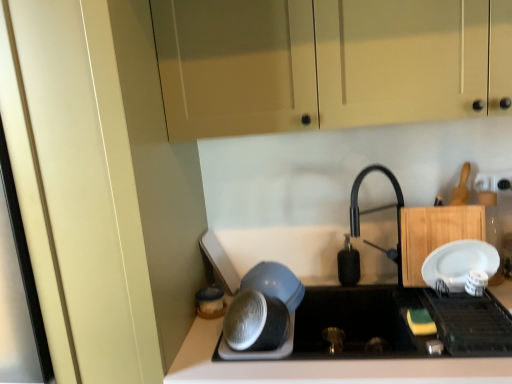
Question: Can we say matte cream cabinet at upper center, the 1th cabinetry when ordered from top to bottom, lies outside black matte soap dispenser at center, marked as the 1th appliance in a back-to-front arrangement?

Choices:
 (A) yes
 (B) no

Answer: (A)

Question: Can you confirm if matte cream cabinet at upper center, the second cabinetry ordered from the bottom, is thinner than black matte soap dispenser at center, placed as the 2th appliance when sorted from right to left?

Choices:
 (A) no
 (B) yes

Answer: (A)

Question: Is matte cream cabinet at upper center, the 1th cabinetry when ordered from top to bottom, shorter than black matte soap dispenser at center, placed as the 2th appliance when sorted from right to left?

Choices:
 (A) yes
 (B) no

Answer: (B)

Question: Can black matte soap dispenser at center, which is the 4th appliance from front to back, be found inside matte cream cabinet at upper center, the second cabinetry ordered from the bottom?

Choices:
 (A) no
 (B) yes

Answer: (A)

Question: Is matte cream cabinet at upper center, the 1th cabinetry when ordered from top to bottom, closer to camera compared to black matte soap dispenser at center, marked as the 1th appliance in a back-to-front arrangement?

Choices:
 (A) no
 (B) yes

Answer: (B)

Question: Can you confirm if matte cream cabinet at upper center, the second cabinetry ordered from the bottom, is positioned to the left of black matte soap dispenser at center, placed as the 2th appliance when sorted from right to left?

Choices:
 (A) no
 (B) yes

Answer: (B)

Question: Can you confirm if matte plastic container at lower center, which appears as the second appliance when viewed from the back, is smaller than black matte soap dispenser at center, marked as the 1th appliance in a back-to-front arrangement?

Choices:
 (A) no
 (B) yes

Answer: (B)

Question: Would you say matte plastic container at lower center, which appears as the second appliance when viewed from the back, is a long distance from black matte soap dispenser at center, marked as the 1th appliance in a back-to-front arrangement?

Choices:
 (A) yes
 (B) no

Answer: (B)

Question: Is matte plastic container at lower center, marked as the first appliance in a left-to-right arrangement, not inside black matte soap dispenser at center, marked as the 1th appliance in a back-to-front arrangement?

Choices:
 (A) no
 (B) yes

Answer: (B)

Question: Is black matte soap dispenser at center, which is the 4th appliance from front to back, inside matte plastic container at lower center, marked as the fourth appliance in a right-to-left arrangement?

Choices:
 (A) yes
 (B) no

Answer: (B)

Question: Is matte plastic container at lower center, which appears as the second appliance when viewed from the back, oriented away from black matte soap dispenser at center, marked as the third appliance in a left-to-right arrangement?

Choices:
 (A) no
 (B) yes

Answer: (A)

Question: Does matte plastic container at lower center, marked as the first appliance in a left-to-right arrangement, have a lesser width compared to black matte soap dispenser at center, which is the 4th appliance from front to back?

Choices:
 (A) yes
 (B) no

Answer: (B)

Question: Can you confirm if black matte soap dispenser at center, marked as the 1th appliance in a back-to-front arrangement, is shorter than white plastic electric outlet at upper right?

Choices:
 (A) yes
 (B) no

Answer: (B)